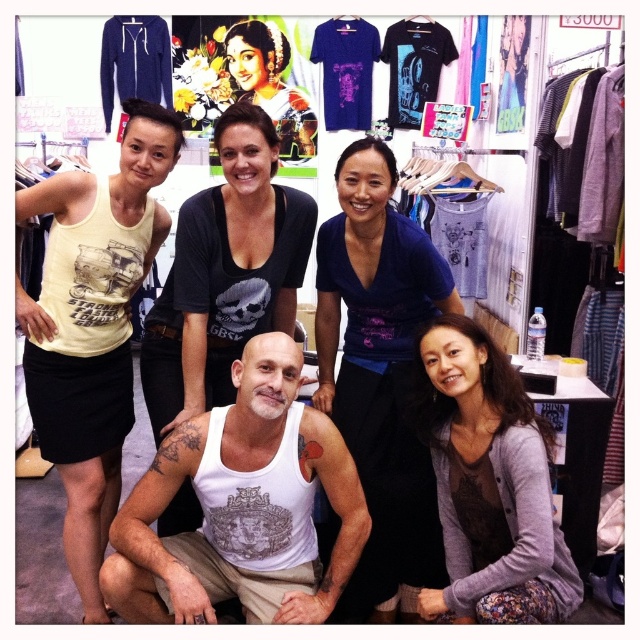
Does white cotton tank top at center have a greater width compared to gray cardigan at lower right?

Yes.

Based on the photo, does white cotton tank top at center appear on the right side of gray cardigan at lower right?

In fact, white cotton tank top at center is to the left of gray cardigan at lower right.

Between point (266, 576) and point (563, 586), which one is positioned behind?

Positioned behind is point (266, 576).

Identify the location of white cotton tank top at center. (241, 506).

Is yellow matte tank top at left shorter than matte black tank top at center?

No, yellow matte tank top at left is not shorter than matte black tank top at center.

Describe the element at coordinates (92, 326) in the screenshot. I see `yellow matte tank top at left` at that location.

The height and width of the screenshot is (640, 640). In order to click on yellow matte tank top at left in this screenshot , I will do tap(92, 326).

You are a GUI agent. You are given a task and a screenshot of the screen. Output one action in this format:
    pyautogui.click(x=<x>, y=<y>)
    Task: Click on the yellow matte tank top at left
    The height and width of the screenshot is (640, 640).
    Given the screenshot: What is the action you would take?
    pyautogui.click(x=92, y=326)

Is white cotton tank top at center shorter than matte black dress at upper center?

Indeed, white cotton tank top at center has a lesser height compared to matte black dress at upper center.

Between white cotton tank top at center and matte black dress at upper center, which one appears on the right side from the viewer's perspective?

From the viewer's perspective, white cotton tank top at center appears more on the right side.

Does point (262, 460) come closer to viewer compared to point (264, 45)?

Yes.

Locate an element on the screen. This screenshot has width=640, height=640. white cotton tank top at center is located at coordinates (241, 506).